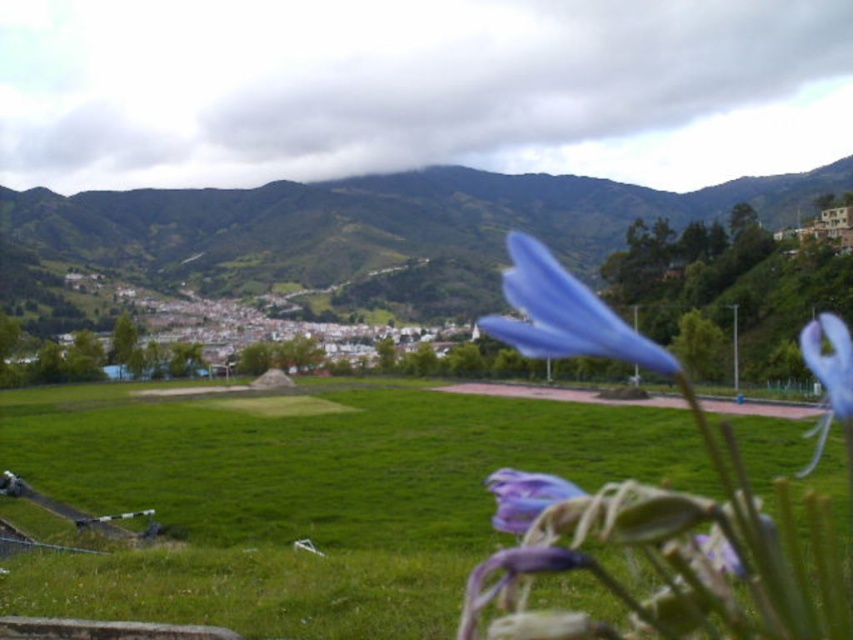
Can you confirm if green grassy field at center is positioned to the left of purple matte flower at lower center?

Yes, green grassy field at center is to the left of purple matte flower at lower center.

How distant is green grassy field at center from purple matte flower at lower center?

green grassy field at center and purple matte flower at lower center are 26.67 meters apart.

At what (x,y) coordinates should I click in order to perform the action: click on green grassy field at center. Please return your answer as a coordinate pair (x, y). The height and width of the screenshot is (640, 853). Looking at the image, I should click on (306, 499).

Locate an element on the screen. The image size is (853, 640). green grassy field at center is located at coordinates (306, 499).

Can you confirm if green grassy field at center is smaller than blue matte flower at center?

Indeed, green grassy field at center has a smaller size compared to blue matte flower at center.

The width and height of the screenshot is (853, 640). Find the location of `green grassy field at center`. green grassy field at center is located at coordinates (306, 499).

Can you confirm if green grassy field at center is wider than purple matte flower at center?

Yes.

Can you confirm if green grassy field at center is bigger than purple matte flower at center?

Correct, green grassy field at center is larger in size than purple matte flower at center.

Does point (837, 536) come farther from viewer compared to point (837, 352)?

No.

The height and width of the screenshot is (640, 853). In order to click on green grassy field at center in this screenshot , I will do `click(306, 499)`.